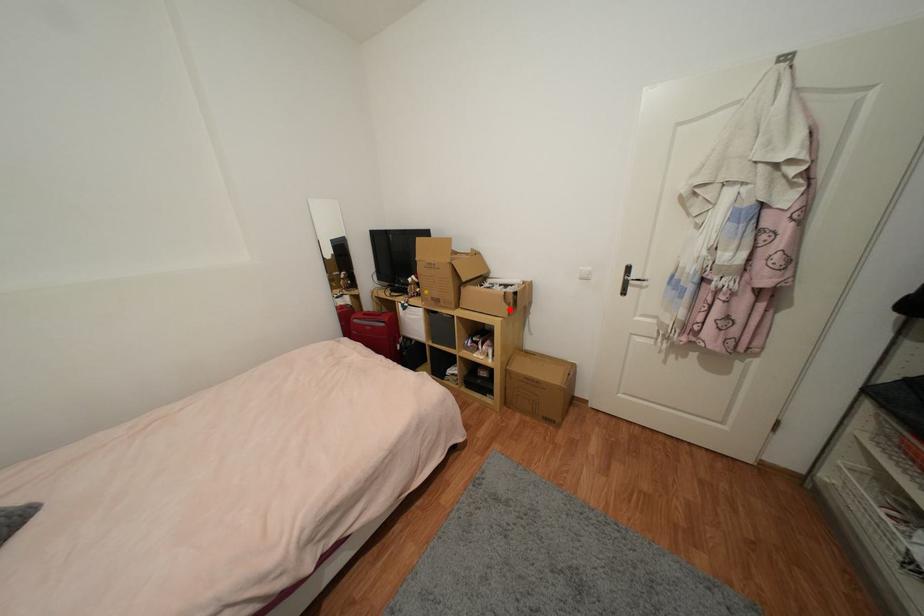
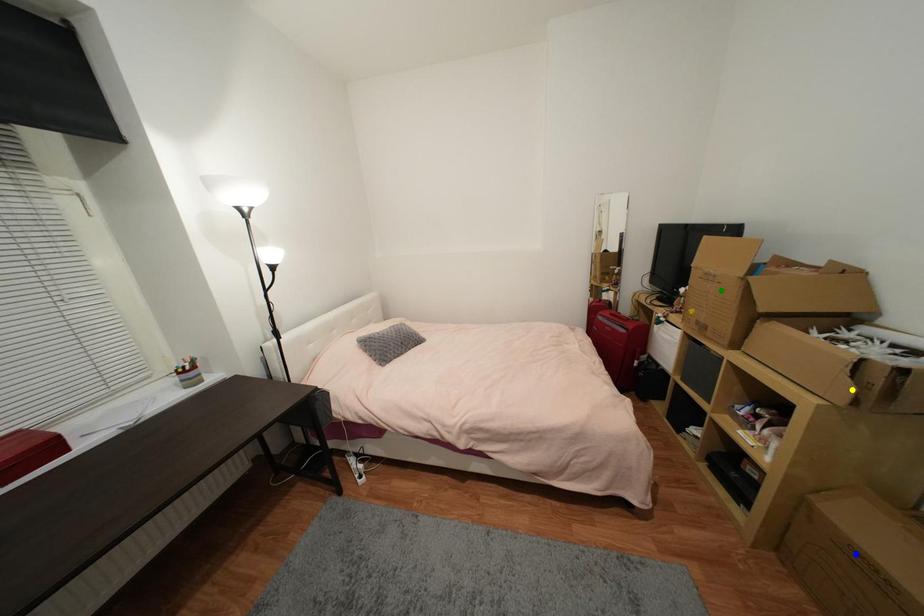
Question: I am providing you with two images of the same scene from different viewpoints. A red point is marked on the first image. You are given multiple points on the second image. Can you choose the point in image 2 that corresponds to the point in image 1?

Choices:
 (A) yellow point
 (B) green point
 (C) blue point

Answer: (A)